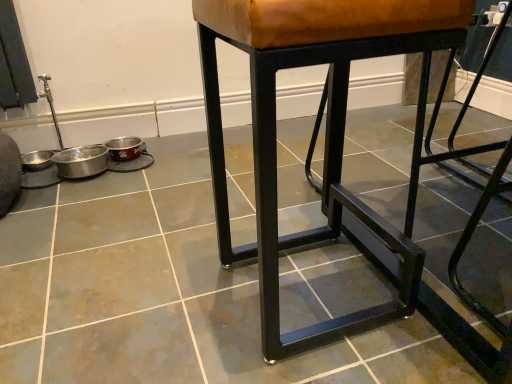
Question: From a real-world perspective, is black metal stool at center above or below brown leather stool at center?

Choices:
 (A) below
 (B) above

Answer: (A)

Question: Based on their positions, is black metal stool at center located to the left or right of brown leather stool at center?

Choices:
 (A) left
 (B) right

Answer: (A)

Question: Considering the positions of black metal stool at center and brown leather stool at center in the image, is black metal stool at center taller or shorter than brown leather stool at center?

Choices:
 (A) tall
 (B) short

Answer: (B)

Question: Is brown leather stool at center in front of or behind black metal stool at center in the image?

Choices:
 (A) front
 (B) behind

Answer: (B)

Question: From the image's perspective, is brown leather stool at center above or below black metal stool at center?

Choices:
 (A) above
 (B) below

Answer: (A)

Question: Is brown leather stool at center inside the boundaries of black metal stool at center, or outside?

Choices:
 (A) outside
 (B) inside

Answer: (A)

Question: Would you say brown leather stool at center is to the left or to the right of black metal stool at center in the picture?

Choices:
 (A) right
 (B) left

Answer: (A)